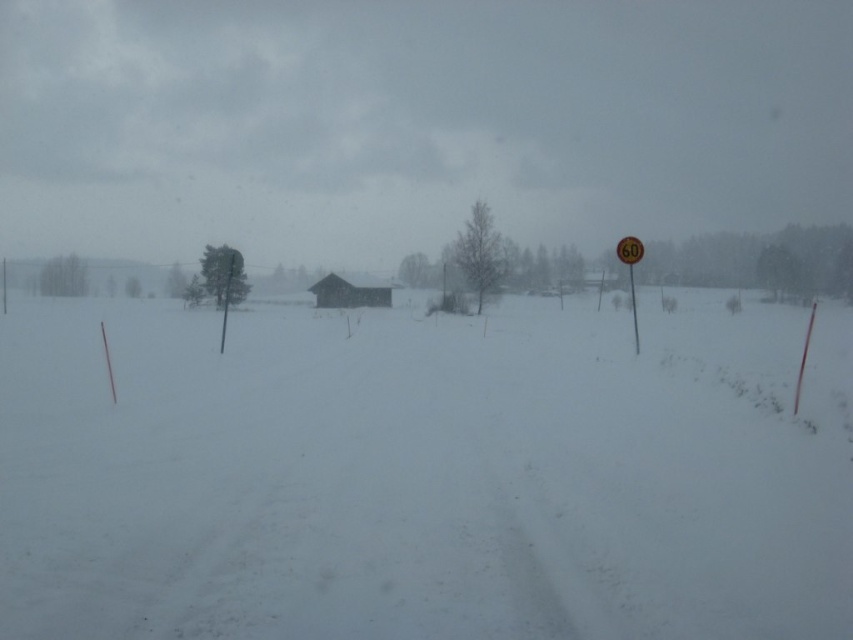
Question: Which object is positioned closest to the metallic signpost at right?

Choices:
 (A) white powdery snow at center
 (B) orange reflective sign at right

Answer: (A)

Question: Is white powdery snow at center above orange reflective sign at right?

Choices:
 (A) yes
 (B) no

Answer: (B)

Question: Among these objects, which one is nearest to the camera?

Choices:
 (A) metallic signpost at right
 (B) white powdery snow at center
 (C) yellow reflective plastic speed limit sign at right

Answer: (B)

Question: Considering the real-world distances, which object is farthest from the metallic signpost at right?

Choices:
 (A) brown wooden hut at center
 (B) orange reflective sign at right
 (C) white powdery snow at center
 (D) yellow reflective plastic speed limit sign at right

Answer: (A)

Question: Can you confirm if brown wooden hut at center is positioned above yellow reflective plastic speed limit sign at right?

Choices:
 (A) no
 (B) yes

Answer: (B)

Question: Does yellow reflective plastic speed limit sign at right have a larger size compared to metallic signpost at right?

Choices:
 (A) yes
 (B) no

Answer: (A)